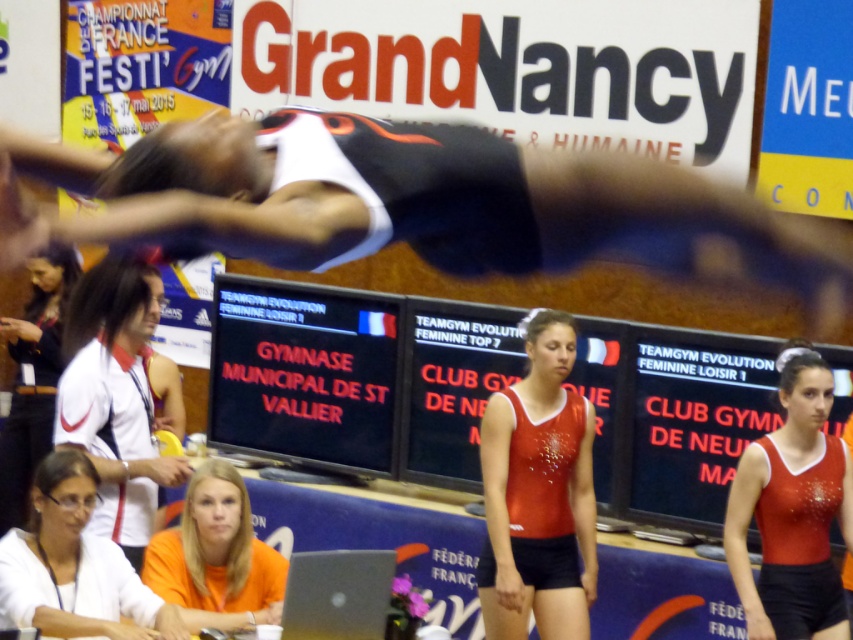
Between shiny red leotard at center and silver metallic laptop at lower center, which one is positioned higher?

shiny red leotard at center is higher up.

Which is below, shiny red leotard at center or silver metallic laptop at lower center?

Positioned lower is silver metallic laptop at lower center.

Is point (583, 540) farther from viewer compared to point (366, 605)?

Yes, point (583, 540) is behind point (366, 605).

The height and width of the screenshot is (640, 853). I want to click on shiny red leotard at center, so click(538, 493).

Is white fabric at lower left smaller than silver metallic laptop at lower center?

Actually, white fabric at lower left might be larger than silver metallic laptop at lower center.

Is point (100, 586) less distant than point (368, 593)?

No, (100, 586) is further to viewer.

This screenshot has height=640, width=853. Find the location of `white fabric at lower left`. white fabric at lower left is located at coordinates (x=74, y=564).

Does shiny red leotard at center have a larger size compared to matte black shirt at lower left?

No, shiny red leotard at center is not bigger than matte black shirt at lower left.

Is shiny red leotard at center wider than matte black shirt at lower left?

Correct, the width of shiny red leotard at center exceeds that of matte black shirt at lower left.

Who is more forward, (543,520) or (62,294)?

Positioned in front is point (543,520).

Where is `shiny red leotard at center`? The width and height of the screenshot is (853, 640). shiny red leotard at center is located at coordinates (538, 493).